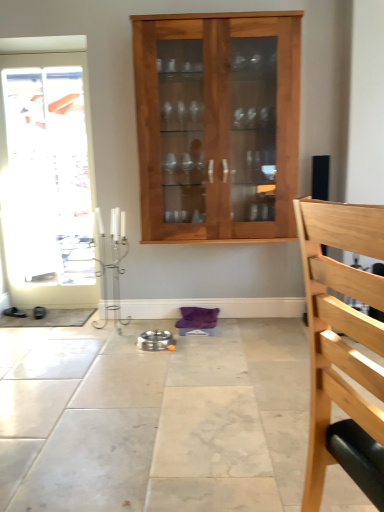
Question: From a real-world perspective, does white glossy door at left sit lower than black leather shoes at lower left?

Choices:
 (A) no
 (B) yes

Answer: (A)

Question: Considering the relative sizes of white glossy door at left and black leather shoes at lower left in the image provided, is white glossy door at left shorter than black leather shoes at lower left?

Choices:
 (A) no
 (B) yes

Answer: (A)

Question: Is black leather shoes at lower left surrounded by white glossy door at left?

Choices:
 (A) yes
 (B) no

Answer: (B)

Question: Is white glossy door at left oriented away from black leather shoes at lower left?

Choices:
 (A) yes
 (B) no

Answer: (B)

Question: Does white glossy door at left have a larger size compared to black leather shoes at lower left?

Choices:
 (A) yes
 (B) no

Answer: (A)

Question: Is white glossy door at left thinner than black leather shoes at lower left?

Choices:
 (A) yes
 (B) no

Answer: (A)

Question: Does light brown wood cabinet at center have a smaller size compared to black leather shoes at lower left?

Choices:
 (A) no
 (B) yes

Answer: (A)

Question: Is light brown wood cabinet at center bigger than black leather shoes at lower left?

Choices:
 (A) no
 (B) yes

Answer: (B)

Question: From the image's perspective, is light brown wood cabinet at center located beneath black leather shoes at lower left?

Choices:
 (A) yes
 (B) no

Answer: (B)

Question: Considering the relative sizes of light brown wood cabinet at center and black leather shoes at lower left in the image provided, is light brown wood cabinet at center shorter than black leather shoes at lower left?

Choices:
 (A) yes
 (B) no

Answer: (B)

Question: Considering the relative sizes of light brown wood cabinet at center and black leather shoes at lower left in the image provided, is light brown wood cabinet at center taller than black leather shoes at lower left?

Choices:
 (A) yes
 (B) no

Answer: (A)

Question: Can you confirm if light brown wood cabinet at center is positioned to the left of black leather shoes at lower left?

Choices:
 (A) no
 (B) yes

Answer: (A)

Question: Does light wood chair at right appear on the right side of black leather shoes at lower left?

Choices:
 (A) no
 (B) yes

Answer: (B)